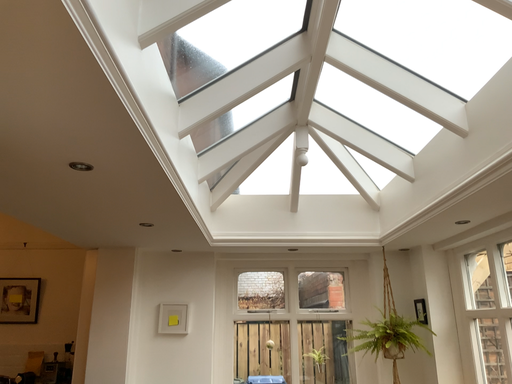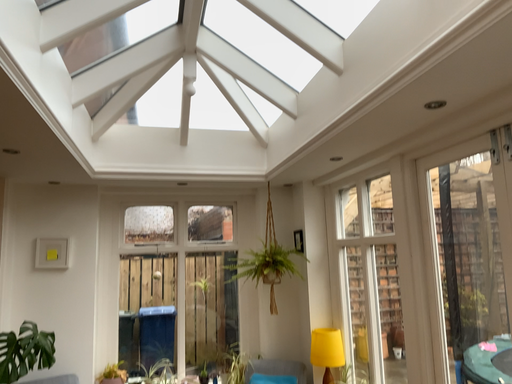
Question: How did the camera likely rotate when shooting the video?

Choices:
 (A) rotated downward
 (B) rotated upward

Answer: (A)